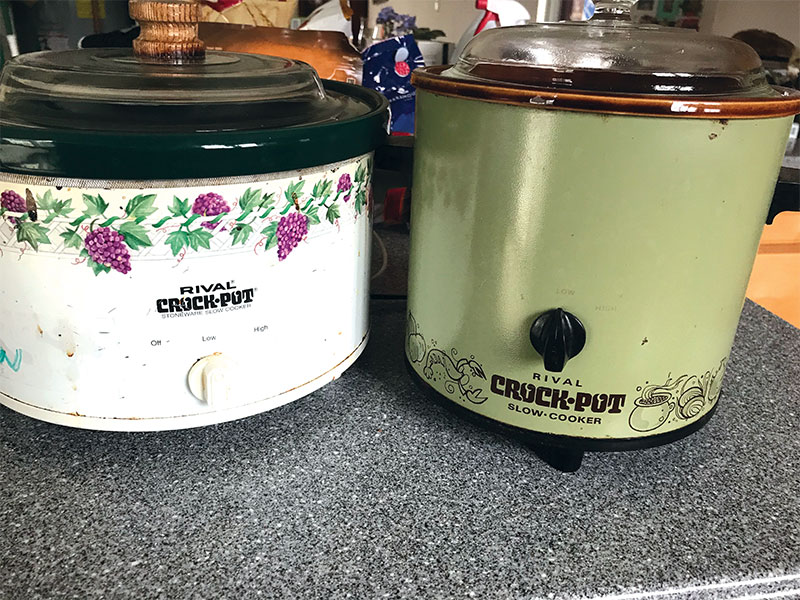
Identify the location of crock pot tops. This screenshot has width=800, height=600. (169, 80), (618, 56).